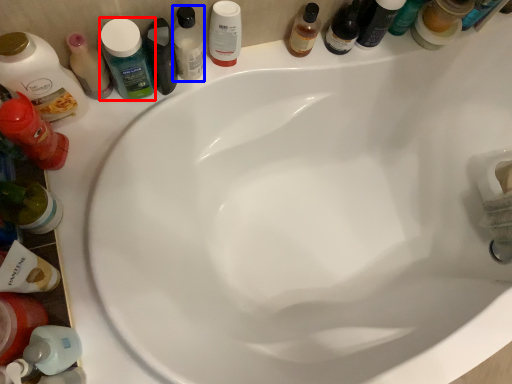
Question: Among these objects, which one is farthest to the camera, mouthwash (highlighted by a red box) or mouthwash (highlighted by a blue box)?

Choices:
 (A) mouthwash
 (B) mouthwash

Answer: (B)